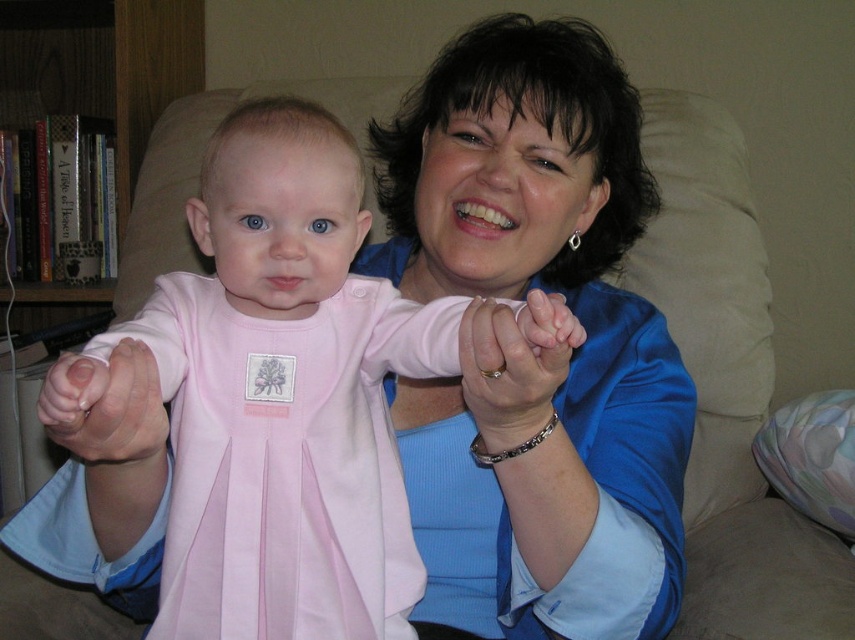
You are a photographer trying to capture a closeup shot of both the smooth skin hand at center and the pink fabric baby hand at center. Based on their sizes, which hand should you focus on to ensure both fit within the frame without cropping?

The smooth skin hand at center is smaller than the pink fabric baby hand at center. To ensure both fit within the frame without cropping, focus on the pink fabric baby hand at center as it is larger and will require more space.

From the picture: In the image, you see an adult holding the pink fabric baby hand at center and the pink satin dress at center. Which object is located to the right of the other?

The pink satin dress at center is positioned on the right side of pink fabric baby hand at center.

You are a photographer setting up for a family photo shoot. You need to position a small prop between the smooth skin hand at center and the pink fabric baby hand at center so that it is equidistant from both hands. What is the minimum length the prop should be to ensure it can fit between them without touching either hand?

The smooth skin hand at center and pink fabric baby hand at center are 8.80 inches apart. To place a prop equidistant between them, the prop must be at least 4.40 inches long to span half the distance between the two hands without touching either.